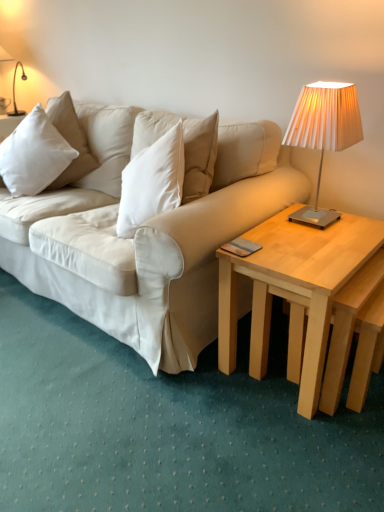
Question: Is light wood/natural wood coffee table at right positioned before metallic pleated lampshade at upper right?

Choices:
 (A) no
 (B) yes

Answer: (B)

Question: Is light wood/natural wood coffee table at right thinner than metallic pleated lampshade at upper right?

Choices:
 (A) yes
 (B) no

Answer: (B)

Question: Could you tell me if light wood/natural wood coffee table at right is facing metallic pleated lampshade at upper right?

Choices:
 (A) no
 (B) yes

Answer: (A)

Question: From the image's perspective, is light wood/natural wood coffee table at right under metallic pleated lampshade at upper right?

Choices:
 (A) no
 (B) yes

Answer: (B)

Question: Is metallic pleated lampshade at upper right at the back of light wood/natural wood coffee table at right?

Choices:
 (A) yes
 (B) no

Answer: (B)

Question: Is light wood/natural wood coffee table at right completely or partially outside of metallic pleated lampshade at upper right?

Choices:
 (A) no
 (B) yes

Answer: (B)

Question: Does metallic pleated lampshade at upper right turn towards light wood/natural wood coffee table at right?

Choices:
 (A) yes
 (B) no

Answer: (B)

Question: Considering the relative sizes of metallic pleated lampshade at upper right and light wood/natural wood coffee table at right in the image provided, is metallic pleated lampshade at upper right thinner than light wood/natural wood coffee table at right?

Choices:
 (A) yes
 (B) no

Answer: (A)

Question: Is metallic pleated lampshade at upper right outside light wood/natural wood coffee table at right?

Choices:
 (A) no
 (B) yes

Answer: (B)

Question: Are metallic pleated lampshade at upper right and light wood/natural wood coffee table at right making contact?

Choices:
 (A) yes
 (B) no

Answer: (B)

Question: From the image's perspective, is metallic pleated lampshade at upper right above light wood/natural wood coffee table at right?

Choices:
 (A) yes
 (B) no

Answer: (A)

Question: Considering the relative positions of metallic pleated lampshade at upper right and light wood/natural wood coffee table at right in the image provided, is metallic pleated lampshade at upper right behind light wood/natural wood coffee table at right?

Choices:
 (A) no
 (B) yes

Answer: (B)

Question: Is light wood/natural wood coffee table at right not within white soft pillow at left?

Choices:
 (A) yes
 (B) no

Answer: (A)